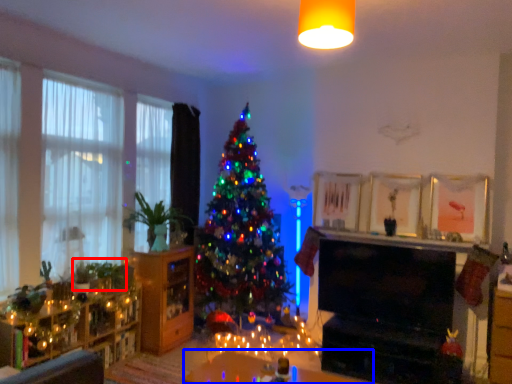
Question: Which of the following is the closest to the observer, plant (highlighted by a red box) or table (highlighted by a blue box)?

Choices:
 (A) plant
 (B) table

Answer: (B)